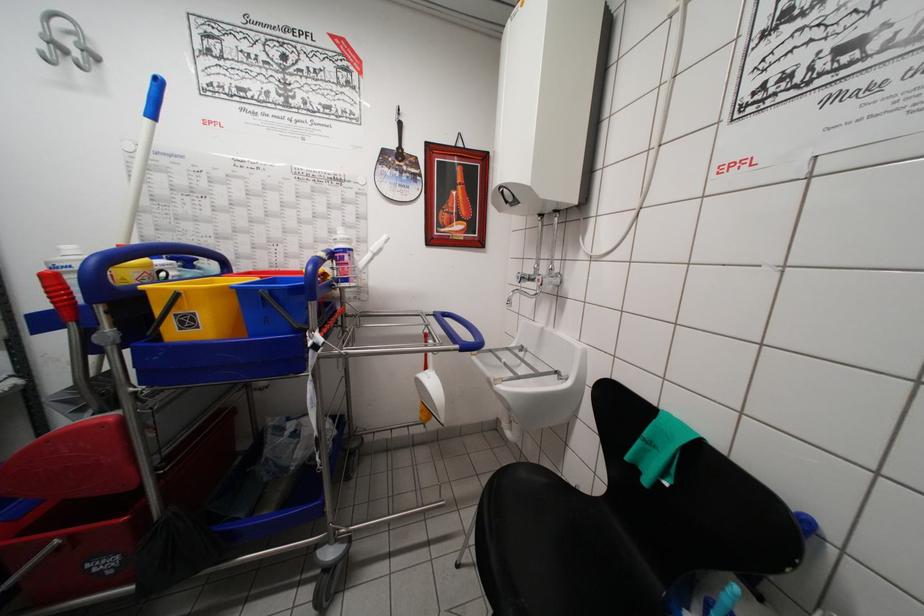
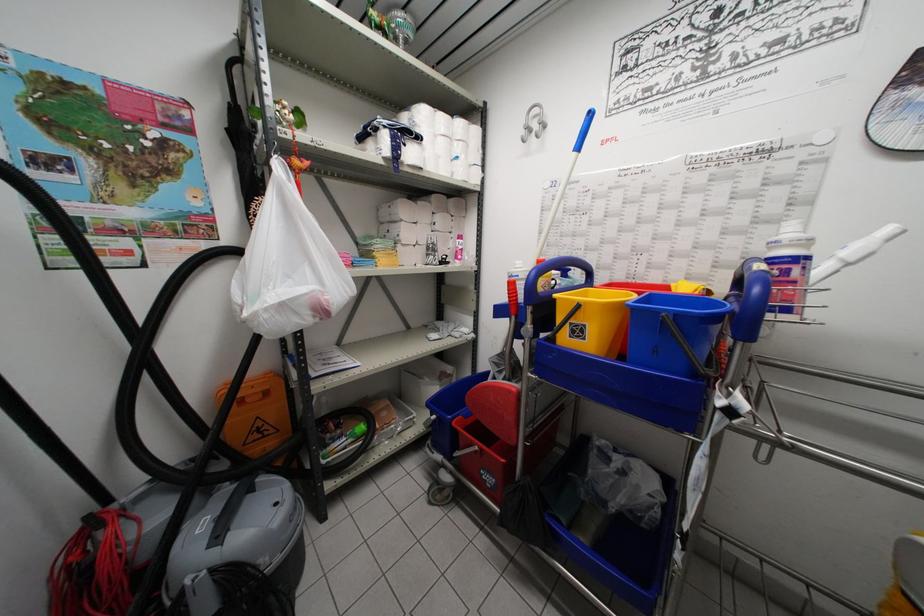
Question: The camera is either moving clockwise (left) or counter-clockwise (right) around the object. The first image is from the beginning of the video and the second image is from the end. Is the camera moving left or right when shooting the video?

Choices:
 (A) Left
 (B) Right

Answer: (B)